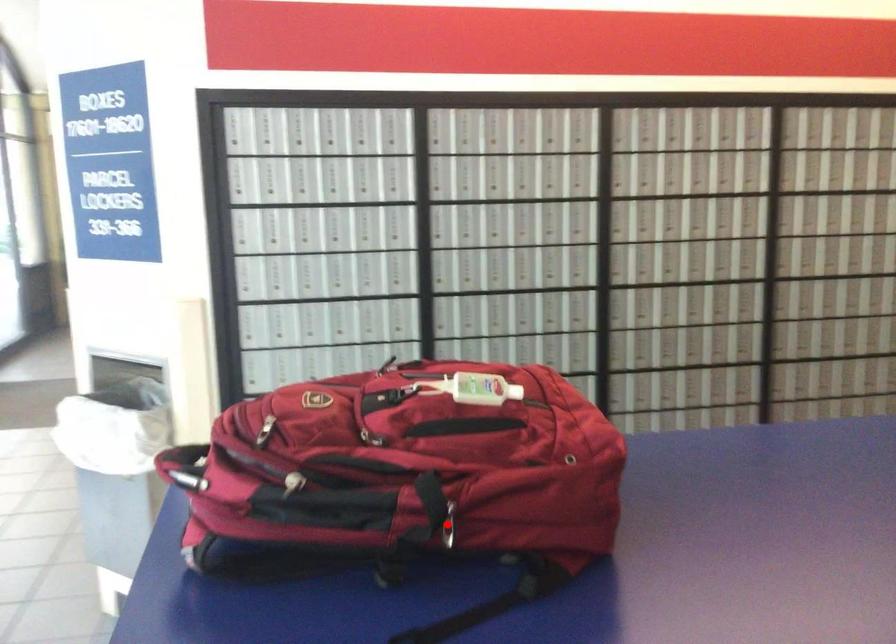
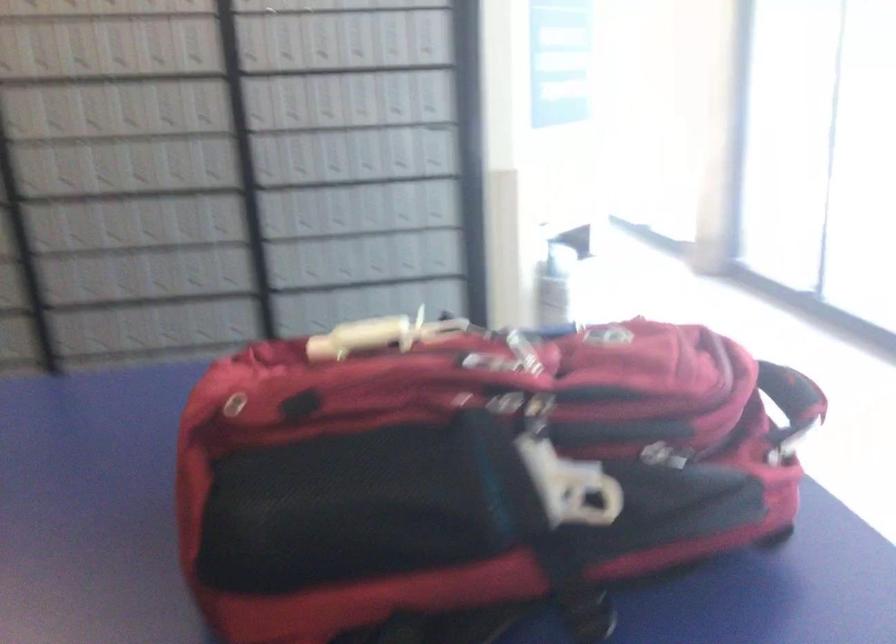
Question: I am providing you with two images of the same scene from different viewpoints. A red point is marked on the first image. Is the red point's position out of view in image 2?

Choices:
 (A) Yes
 (B) No

Answer: (A)